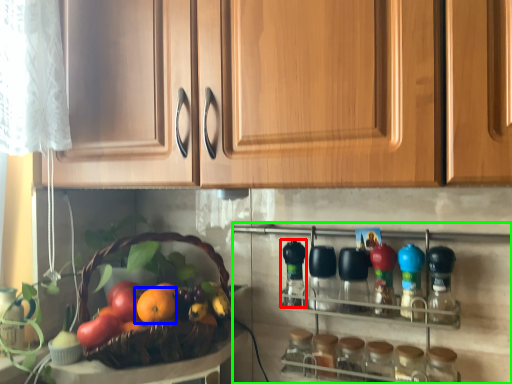
Question: Which is nearer to the bottle (highlighted by a red box)? orange (highlighted by a blue box) or shelf (highlighted by a green box).

Choices:
 (A) orange
 (B) shelf

Answer: (B)